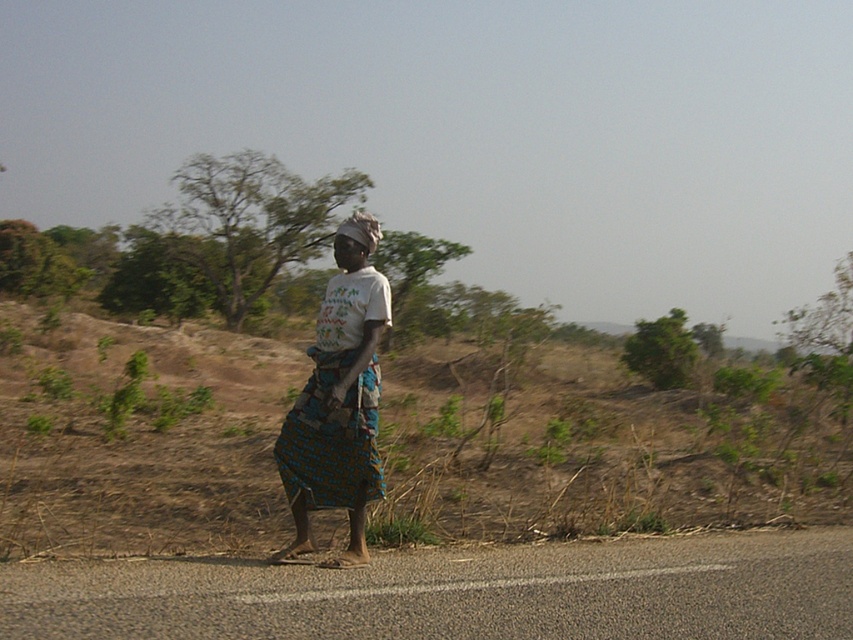
You are a fashion designer observing the rural scene. You notice the printed fabric skirt at center and the dark brown fabric headscarf at center. Which clothing item is closer to the camera?

The printed fabric skirt at center is closer to the camera than the dark brown fabric headscarf at center because it is positioned in front of it.

You are a photographer trying to capture the printed fabric skirt at center in your shot. Based on the scene description, where should you position your camera to ensure the skirt is centered in the frame?

The printed fabric skirt at center is already positioned at the center of the image, so you should aim your camera directly at the center point to capture it.